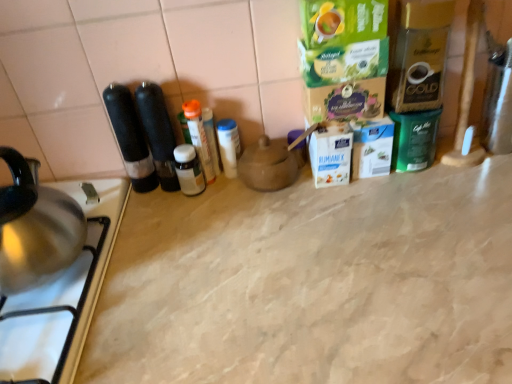
This screenshot has width=512, height=384. What do you see at coordinates (228, 146) in the screenshot?
I see `white plastic container at center, the first bottle positioned from the right` at bounding box center [228, 146].

Where is `matte brown teapot at center`? This screenshot has height=384, width=512. matte brown teapot at center is located at coordinates (267, 166).

Find the location of a particular element. stainless steel gas stove at lower left is located at coordinates (49, 317).

Where is `white plastic container at center, the 3th bottle in the left-to-right sequence`? The image size is (512, 384). white plastic container at center, the 3th bottle in the left-to-right sequence is located at coordinates (228, 146).

Is white plastic container at center, the 3th bottle in the left-to-right sequence, surrounded by white glossy bottle at center, positioned as the 1th bottle in left-to-right order?

No.

Identify the location of the 2nd bottle counting from the right side of the white glossy bottle at center, positioned as the 1th bottle in left-to-right order. (228, 146).

Between white glossy bottle at center, which is the third bottle from right to left, and white plastic container at center, the first bottle positioned from the right, which one has larger width?

white glossy bottle at center, which is the third bottle from right to left.

Is white glossy bottle at center, which is the third bottle from right to left, positioned far away from white plastic container at center, the first bottle positioned from the right?

That's not correct — white glossy bottle at center, which is the third bottle from right to left, is a little close to white plastic container at center, the first bottle positioned from the right.

From the image's perspective, is translucent plastic bottle at center, placed as the second bottle when sorted from left to right, above or below matte brown teapot at center?

translucent plastic bottle at center, placed as the second bottle when sorted from left to right, is above matte brown teapot at center.

Does translucent plastic bottle at center, placed as the second bottle when sorted from left to right, turn towards matte brown teapot at center?

No.

In the image, there is a translucent plastic bottle at center, placed as the second bottle when sorted from left to right. At what (x,y) coordinates should I click in order to perform the action: click on appliance below it (from a real-world perspective). Please return your answer as a coordinate pair (x, y). Image resolution: width=512 pixels, height=384 pixels. Looking at the image, I should click on (267, 166).

What's the angular difference between translucent plastic bottle at center, placed as the second bottle when sorted from left to right, and matte brown teapot at center's facing directions?

2.38 degrees separate the facing orientations of translucent plastic bottle at center, placed as the second bottle when sorted from left to right, and matte brown teapot at center.

Is white glossy bottle at center, which is the third bottle from right to left, oriented towards matte brown teapot at center?

No, white glossy bottle at center, which is the third bottle from right to left, is not facing towards matte brown teapot at center.

From the image's perspective, is white glossy bottle at center, positioned as the 1th bottle in left-to-right order, below matte brown teapot at center?

Yes.

Does white glossy bottle at center, which is the third bottle from right to left, have a greater height compared to matte brown teapot at center?

Yes.

Between white glossy bottle at center, positioned as the 1th bottle in left-to-right order, and matte brown teapot at center, which one appears on the left side from the viewer's perspective?

white glossy bottle at center, positioned as the 1th bottle in left-to-right order.

Looking at this image, which object is closer to the camera taking this photo, white glossy bottle at center, positioned as the 1th bottle in left-to-right order, or beige marble counter top at center?

beige marble counter top at center.

From the picture: Is white glossy bottle at center, positioned as the 1th bottle in left-to-right order, next to beige marble counter top at center and touching it?

white glossy bottle at center, positioned as the 1th bottle in left-to-right order, and beige marble counter top at center are not in contact.

Which of these two, white glossy bottle at center, positioned as the 1th bottle in left-to-right order, or beige marble counter top at center, is smaller?

Smaller between the two is white glossy bottle at center, positioned as the 1th bottle in left-to-right order.

Is white glossy bottle at center, which is the third bottle from right to left, far from translucent plastic bottle at center, placed as the second bottle when sorted from left to right?

No, white glossy bottle at center, which is the third bottle from right to left, is not far away from translucent plastic bottle at center, placed as the second bottle when sorted from left to right.

From a real-world perspective, who is located lower, white glossy bottle at center, positioned as the 1th bottle in left-to-right order, or translucent plastic bottle at center, the 2th bottle from the right?

white glossy bottle at center, positioned as the 1th bottle in left-to-right order, is physically lower.

Looking at this image, which object is closer to the camera taking this photo, white glossy bottle at center, which is the third bottle from right to left, or translucent plastic bottle at center, the 2th bottle from the right?

white glossy bottle at center, which is the third bottle from right to left, is more forward.

Is white glossy bottle at center, which is the third bottle from right to left, shorter than translucent plastic bottle at center, placed as the second bottle when sorted from left to right?

Correct, white glossy bottle at center, which is the third bottle from right to left, is not as tall as translucent plastic bottle at center, placed as the second bottle when sorted from left to right.

Is there a large distance between beige marble counter top at center and white plastic container at center, the first bottle positioned from the right?

No, there isn't a large distance between beige marble counter top at center and white plastic container at center, the first bottle positioned from the right.

Is beige marble counter top at center smaller than white plastic container at center, the first bottle positioned from the right?

No, beige marble counter top at center is not smaller than white plastic container at center, the first bottle positioned from the right.

From a real-world perspective, which is physically above, beige marble counter top at center or white plastic container at center, the first bottle positioned from the right?

From a 3D spatial view, white plastic container at center, the first bottle positioned from the right, is above.

From a real-world perspective, which object stands above the other?

From a 3D spatial view, translucent plastic bottle at center, placed as the second bottle when sorted from left to right, is above.

There is a white glossy bottle at center, which is the third bottle from right to left. At what (x,y) coordinates should I click in order to perform the action: click on the 2nd bottle above it (from the image's perspective). Please return your answer as a coordinate pair (x, y). The height and width of the screenshot is (384, 512). Looking at the image, I should click on (199, 137).

Identify the location of the 2nd bottle behind when counting from the white glossy bottle at center, positioned as the 1th bottle in left-to-right order. (228, 146).

Locate an element on the screen. This screenshot has height=384, width=512. bottle that is the 3rd one above the matte brown teapot at center (from a real-world perspective) is located at coordinates (199, 137).

Based on their spatial positions, is white glossy bottle at center, which is the third bottle from right to left, or stainless steel gas stove at lower left closer to matte brown teapot at center?

white glossy bottle at center, which is the third bottle from right to left.

Based on their spatial positions, is stainless steel gas stove at lower left or translucent plastic bottle at center, the 2th bottle from the right, closer to matte brown teapot at center?

Among the two, translucent plastic bottle at center, the 2th bottle from the right, is located nearer to matte brown teapot at center.

Which object lies nearer to the anchor point matte brown teapot at center, white glossy bottle at center, which is the third bottle from right to left, or beige marble counter top at center?

Based on the image, white glossy bottle at center, which is the third bottle from right to left, appears to be nearer to matte brown teapot at center.

Estimate the real-world distances between objects in this image. Which object is closer to matte brown teapot at center, white plastic container at center, the 3th bottle in the left-to-right sequence, or translucent plastic bottle at center, the 2th bottle from the right?

white plastic container at center, the 3th bottle in the left-to-right sequence.

Considering their positions, is stainless steel gas stove at lower left positioned further to beige marble counter top at center than white plastic container at center, the first bottle positioned from the right?

white plastic container at center, the first bottle positioned from the right, is positioned further to the anchor beige marble counter top at center.

Looking at the image, which one is located closer to matte brown teapot at center, translucent plastic bottle at center, the 2th bottle from the right, or beige marble counter top at center?

translucent plastic bottle at center, the 2th bottle from the right.

Looking at the image, which one is located further to stainless steel gas stove at lower left, white plastic container at center, the 3th bottle in the left-to-right sequence, or beige marble counter top at center?

Among the two, white plastic container at center, the 3th bottle in the left-to-right sequence, is located further to stainless steel gas stove at lower left.

Which object lies nearer to the anchor point translucent plastic bottle at center, the 2th bottle from the right, white glossy bottle at center, positioned as the 1th bottle in left-to-right order, or white plastic container at center, the 3th bottle in the left-to-right sequence?

white glossy bottle at center, positioned as the 1th bottle in left-to-right order.

Find the location of a particular element. Image resolution: width=512 pixels, height=384 pixels. bottle between translucent plastic bottle at center, the 2th bottle from the right, and matte brown teapot at center is located at coordinates (228, 146).

Locate an element on the screen. The width and height of the screenshot is (512, 384). appliance between translucent plastic bottle at center, placed as the second bottle when sorted from left to right, and beige marble counter top at center, in the vertical direction is located at coordinates (267, 166).

Find the location of `bottle situated between stainless steel gas stove at lower left and translucent plastic bottle at center, placed as the second bottle when sorted from left to right, from left to right`. bottle situated between stainless steel gas stove at lower left and translucent plastic bottle at center, placed as the second bottle when sorted from left to right, from left to right is located at coordinates (189, 170).

Locate an element on the screen. The width and height of the screenshot is (512, 384). appliance located between stainless steel gas stove at lower left and beige marble counter top at center in the left-right direction is located at coordinates (267, 166).